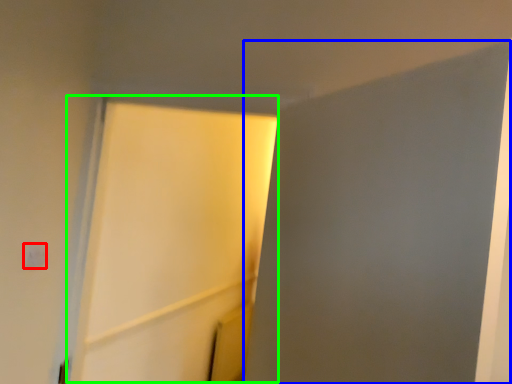
Question: Which object is positioned farthest from light switch (highlighted by a red box)? Select from screen door (highlighted by a blue box) and screen door (highlighted by a green box).

Choices:
 (A) screen door
 (B) screen door

Answer: (B)